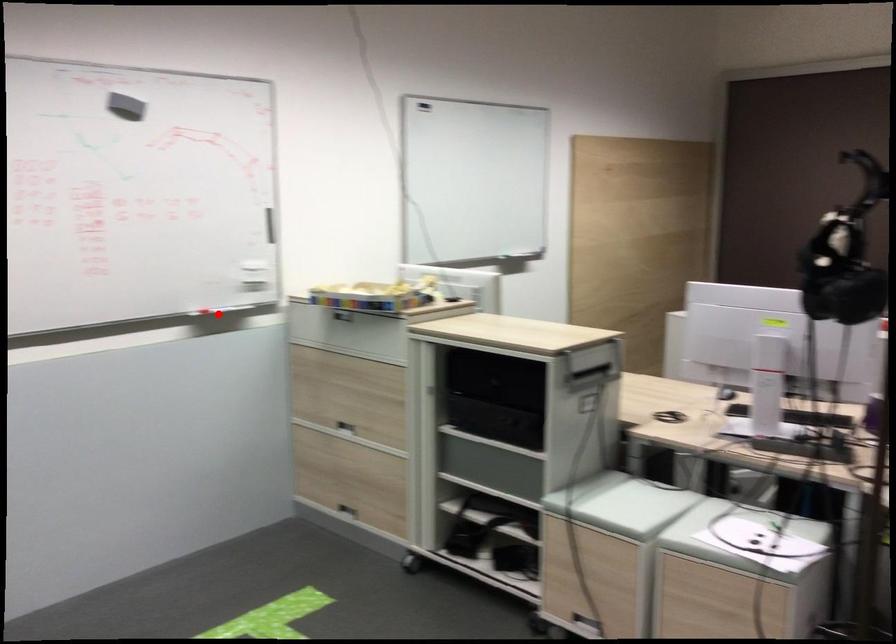
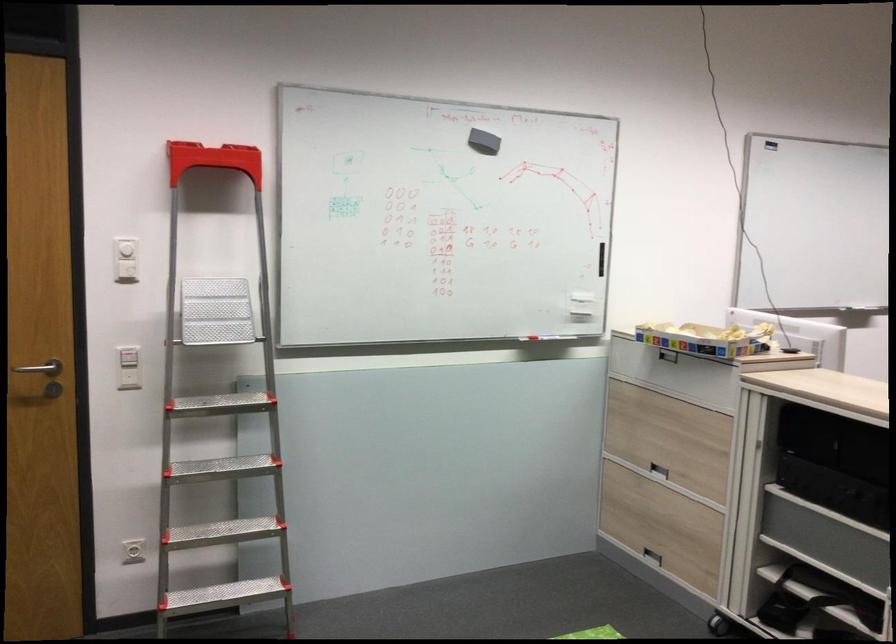
Where in the second image is the point corresponding to the highlighted location from the first image?

(539, 337)